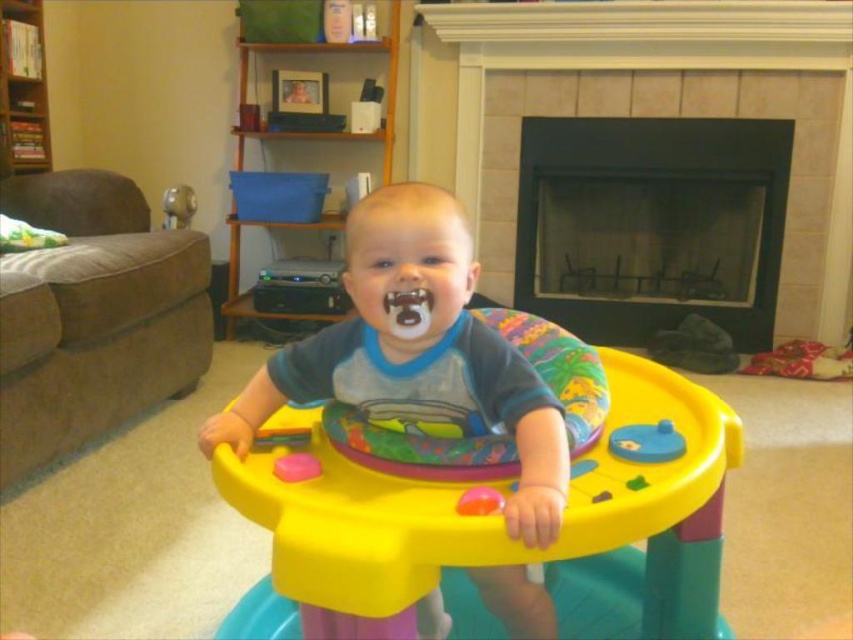
Consider the image. You are a parent holding a baby who wants to place a toy on the smooth stone fireplace at center. The baby is currently sitting in the activity center. Can you reach the fireplace from where the baby is sitting without moving the baby?

The smooth stone fireplace at center is 8.95 feet away from camera. Since the baby is in the activity center and the fireplace is 8.95 feet away, it is likely that the parent would need to move the baby to reach it, as 8.95 feet is a considerable distance for reaching without moving.

You are standing in the living room and want to place a small plant between the two points, point (379, 424) and point (177, 273). Which point should you place the plant closer to so that it is nearer to the baby?

You should place the plant closer to point (379, 424) because it is closer to the baby than point (177, 273).

You are a parent trying to place a new toy between the matte plastic walker at center and the brown fabric couch at left. The toy requires 3.5 feet of space. Is there enough space between them?

The matte plastic walker at center is 4.00 feet from the brown fabric couch at left, so yes, there is enough space to place the toy since 4.00 feet is greater than the required 3.5 feet.